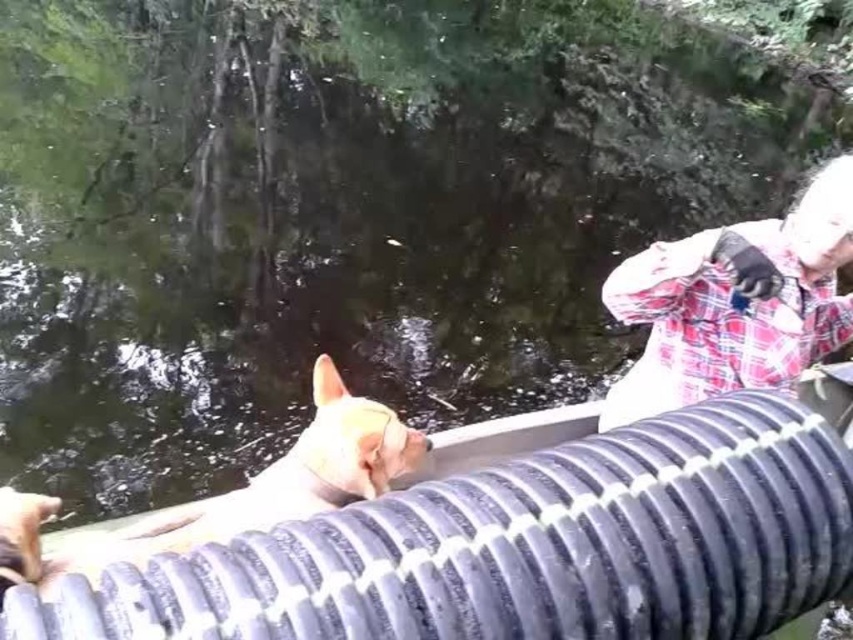
Which is more to the right, black rubber hose at center or light brown fur cat at center?

black rubber hose at center

Does black rubber hose at center have a lesser height compared to light brown fur cat at center?

Correct, black rubber hose at center is not as tall as light brown fur cat at center.

Locate an element on the screen. black rubber hose at center is located at coordinates (520, 547).

Identify the location of black rubber hose at center. (520, 547).

Can you confirm if white plaid shirt at upper right is wider than light brown fur cat at center?

Yes.

Measure the distance from white plaid shirt at upper right to light brown fur cat at center.

white plaid shirt at upper right and light brown fur cat at center are 33.82 inches apart from each other.

Who is more forward, (738, 362) or (6, 513)?

Point (6, 513) is more forward.

Image resolution: width=853 pixels, height=640 pixels. I want to click on white plaid shirt at upper right, so click(734, 301).

Does black rubber hose at center appear on the right side of white plaid shirt at upper right?

No, black rubber hose at center is not to the right of white plaid shirt at upper right.

Can you confirm if black rubber hose at center is bigger than white plaid shirt at upper right?

Incorrect, black rubber hose at center is not larger than white plaid shirt at upper right.

This screenshot has width=853, height=640. I want to click on black rubber hose at center, so click(x=520, y=547).